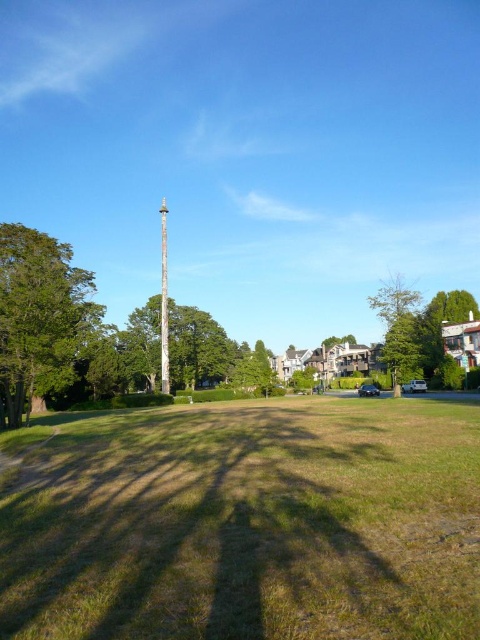
Question: From the image, what is the correct spatial relationship of green leafy tree at right in relation to smooth silver pole at center?

Choices:
 (A) left
 (B) right

Answer: (B)

Question: Which object is closer to the camera taking this photo?

Choices:
 (A) green leafy tree at right
 (B) smooth silver pole at center
 (C) smooth brown pole at center
 (D) green leafy tree at left

Answer: (D)

Question: Which of the following is the farthest from the observer?

Choices:
 (A) (332, 621)
 (B) (46, 358)
 (C) (175, 364)
 (D) (160, 220)

Answer: (D)

Question: Is green grass at center positioned at the back of green leafy tree at right?

Choices:
 (A) yes
 (B) no

Answer: (B)

Question: Can you confirm if smooth brown pole at center is thinner than smooth silver pole at center?

Choices:
 (A) no
 (B) yes

Answer: (B)

Question: Estimate the real-world distances between objects in this image. Which object is farther from the green leafy tree at right?

Choices:
 (A) green grass at center
 (B) smooth silver pole at center
 (C) smooth brown pole at center
 (D) green leafy tree at left

Answer: (B)